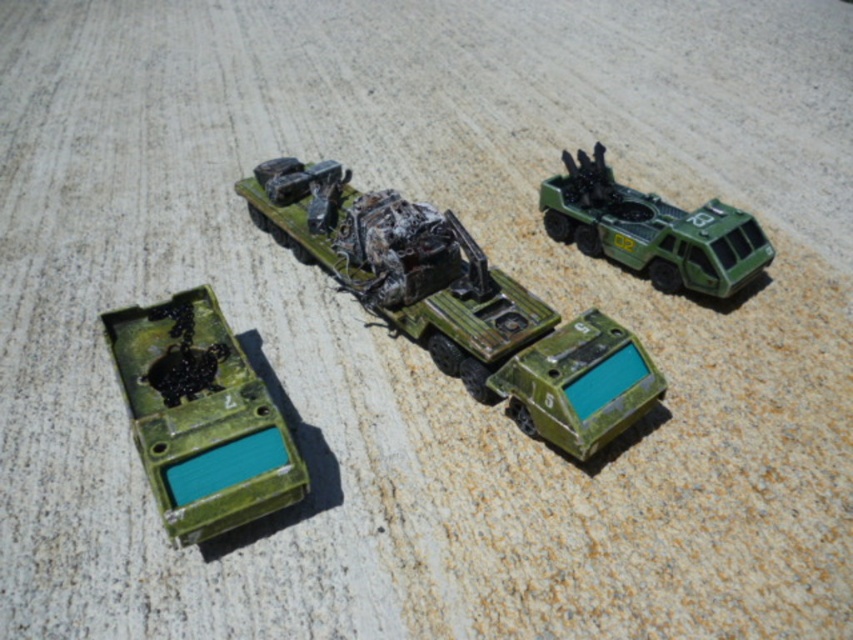
You are a collector organizing miniature military vehicles on a shelf. You have two items to place next to each other on a shelf that can only hold items in a straight line. The first is the matte green plastic at lower left and the second is the matte green plastic tank at lower center. According to the arrangement in the image, which item should you place first on the left side of the shelf?

According to the arrangement in the image, the matte green plastic at lower left is positioned to the left of the matte green plastic tank at lower center, so you should place the matte green plastic at lower left first on the left side of the shelf.

You are a drone operator trying to navigate between two points in the scene. The first point is at coordinate point [277,160] and the second is at coordinate point [570,388]. Which point is closer to the observer?

Point [570,388] is closer to the observer because point [277,160] is behind it.

You are a collector of miniature military vehicles. You have two items in your collection, the matte green plastic at lower left and the matte green plastic tank at lower center. Which one has a greater width?

The matte green plastic at lower left has a greater width than the matte green plastic tank at lower center.